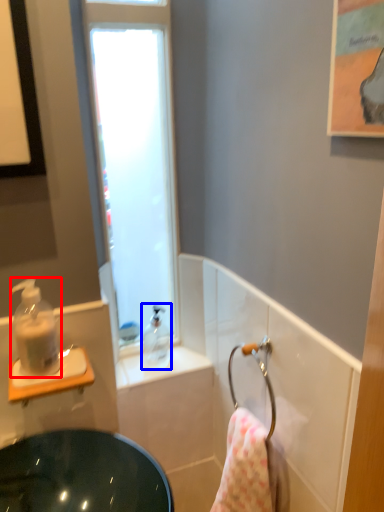
Question: Which object appears farthest to the camera in this image, soap dispenser (highlighted by a red box) or soap dispenser (highlighted by a blue box)?

Choices:
 (A) soap dispenser
 (B) soap dispenser

Answer: (B)